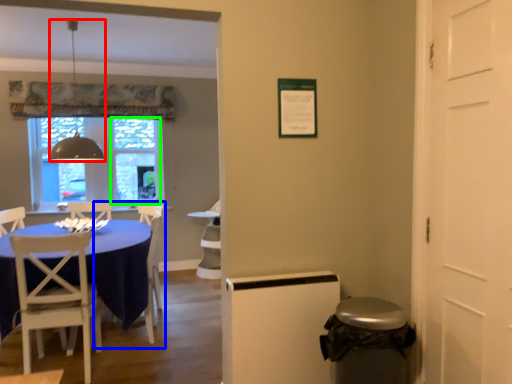
Question: Based on their relative distances, which object is nearer to lamp (highlighted by a red box)? Choose from armchair (highlighted by a blue box) and glass door (highlighted by a green box).

Choices:
 (A) armchair
 (B) glass door

Answer: (A)